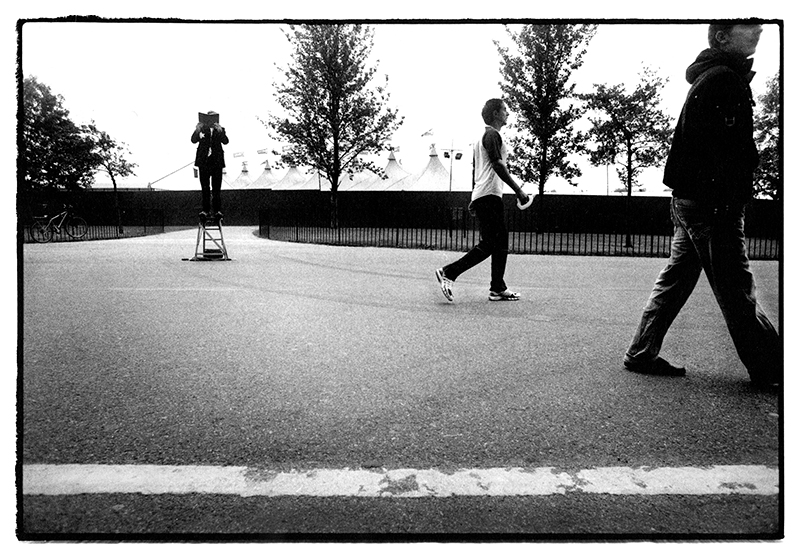
Locate an element on the screen. Image resolution: width=800 pixels, height=559 pixels. book is located at coordinates (210, 120).